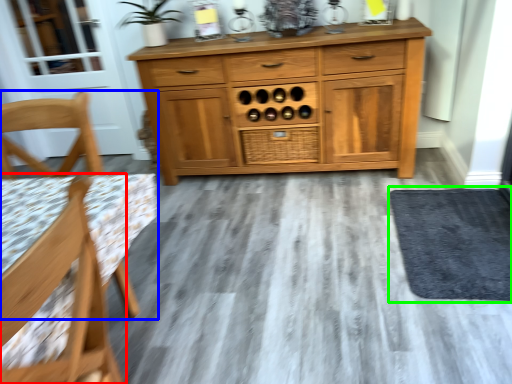
Question: Considering the real-world distances, which object is closest to chair (highlighted by a red box)? chair (highlighted by a blue box) or door (highlighted by a green box).

Choices:
 (A) chair
 (B) door

Answer: (A)